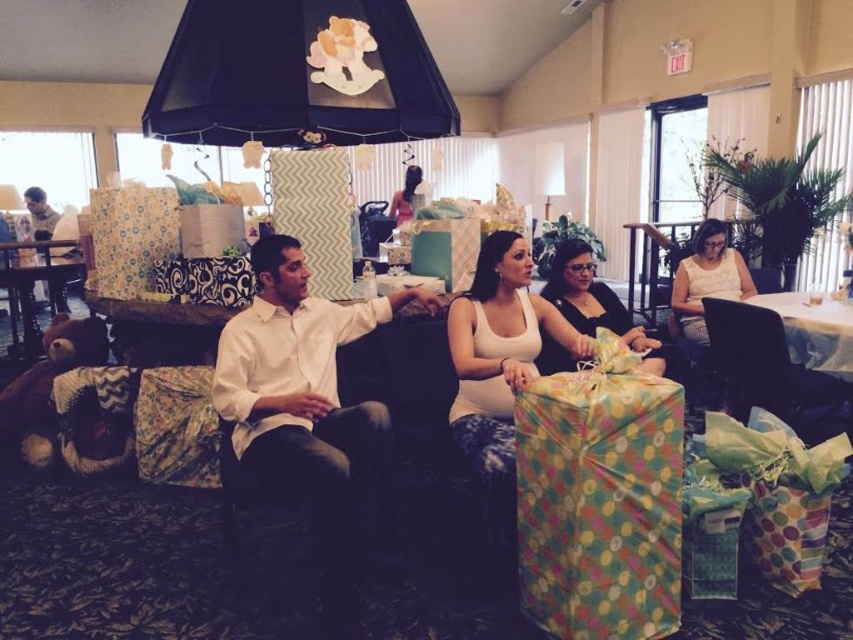
You are a photographer setting up for a group photo at the baby shower. You need to ensure that both the matte white tank top at center and the matte black dress at center are visible in the shot. Given their positions, which clothing item should you adjust to avoid being obscured by the other?

The matte white tank top at center is taller than the matte black dress at center. To ensure both are visible, you should lower the height of the matte white tank top at center or position it behind the matte black dress at center so it doesn not block the view.

You are attending a baby shower and notice two outfits at the center of the table. The first is a matte white tank top at center, and the second is a matte black dress at center. Which item is closer to the floor?

The matte white tank top at center is positioned under the matte black dress at center, so it is closer to the floor.